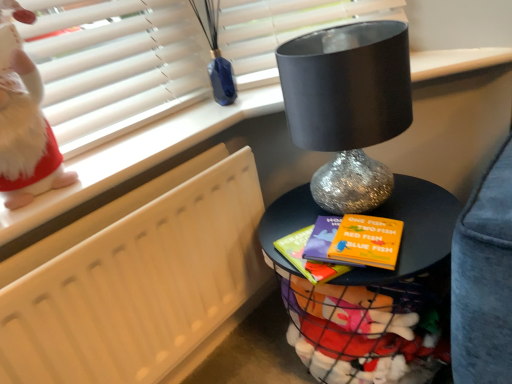
Where is `vacant area that is situated to the right of white fluffy doll at upper left`? vacant area that is situated to the right of white fluffy doll at upper left is located at coordinates (122, 157).